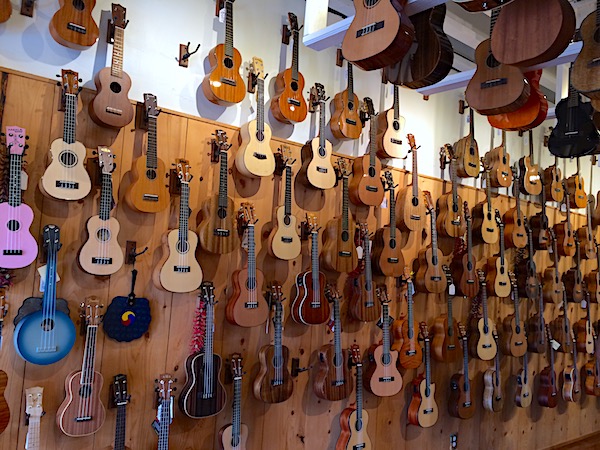
You are a GUI agent. You are given a task and a screenshot of the screen. Output one action in this format:
    pyautogui.click(x=<x>, y=<y>)
    Task: Click on the blue fan
    Image resolution: width=600 pixels, height=450 pixels.
    Given the screenshot: What is the action you would take?
    pyautogui.click(x=139, y=330)